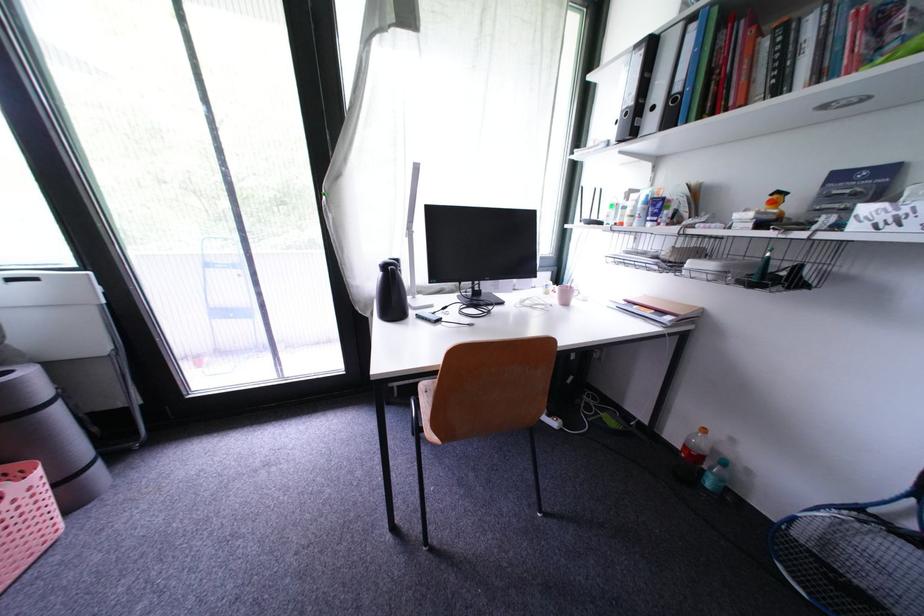
Where would you grip the black thermos handle? Please return your answer as a coordinate pair (x, y).

(400, 291)